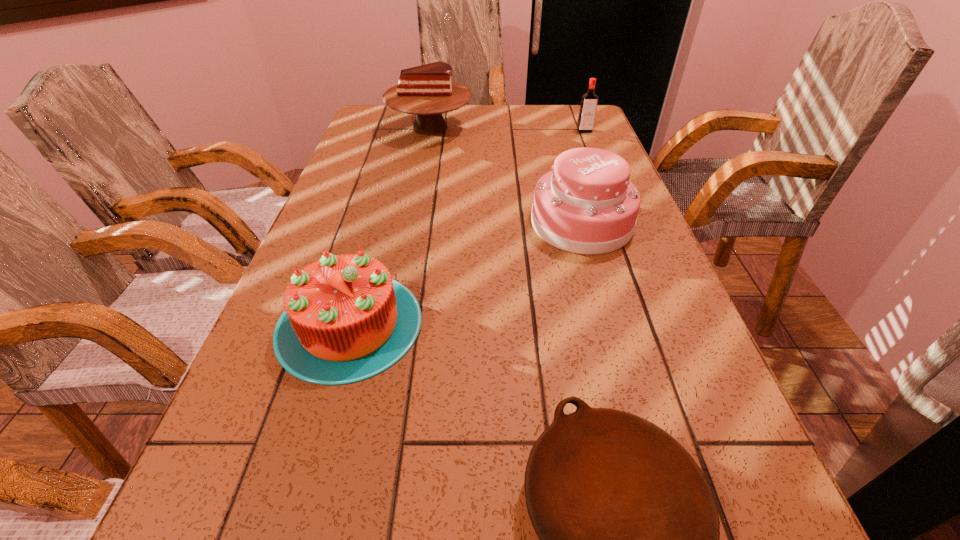
I want to click on vodka located in the far edge section of the desktop, so click(x=589, y=101).

Find the location of a particular element. This screenshot has height=540, width=960. vodka that is at the right edge is located at coordinates (589, 101).

Where is `cake positioned at the right edge`? The width and height of the screenshot is (960, 540). cake positioned at the right edge is located at coordinates (586, 205).

Find the location of `object present at the far left corner`. object present at the far left corner is located at coordinates (427, 90).

In order to click on object present at the far right corner in this screenshot , I will do `click(589, 101)`.

What are the coordinates of `vacant space at the far edge of the desktop` in the screenshot? It's located at (526, 104).

The width and height of the screenshot is (960, 540). In order to click on vacant space at the left edge in this screenshot , I will do `click(294, 268)`.

Identify the location of vacant space at the right edge. This screenshot has height=540, width=960. (640, 415).

I want to click on vacant point located between the farthest cake and the nearest cake, so click(x=390, y=226).

Find the location of a particular element. vacant area between the fourth farthest object and the farthest cake is located at coordinates (390, 226).